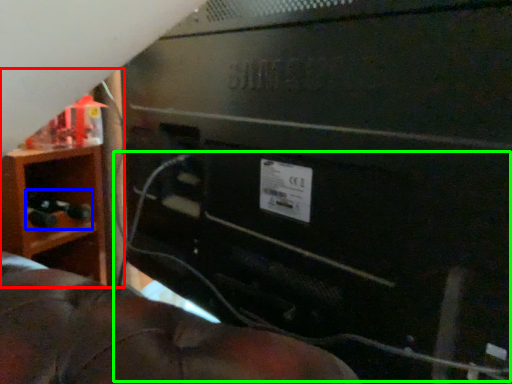
Question: Which is farther away from furniture (highlighted by a red box)? toy (highlighted by a blue box) or wire (highlighted by a green box)?

Choices:
 (A) toy
 (B) wire

Answer: (B)